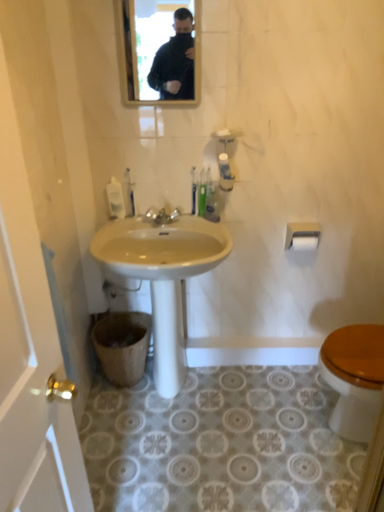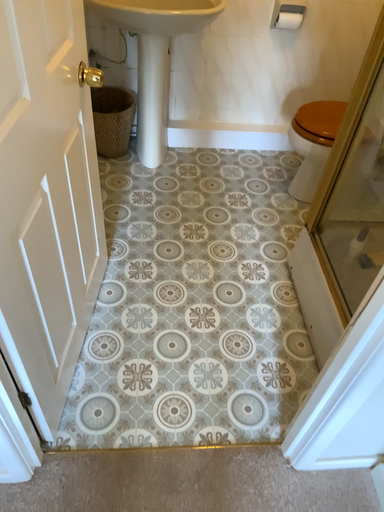
Question: How did the camera likely rotate when shooting the video?

Choices:
 (A) rotated upward
 (B) rotated downward

Answer: (B)